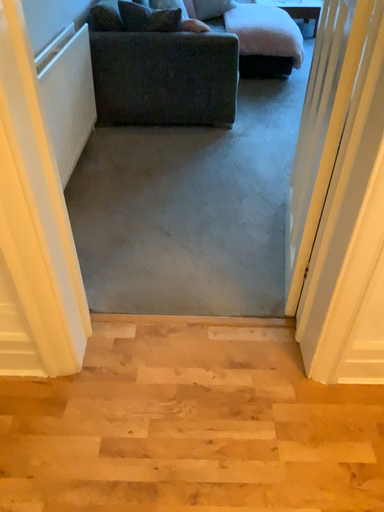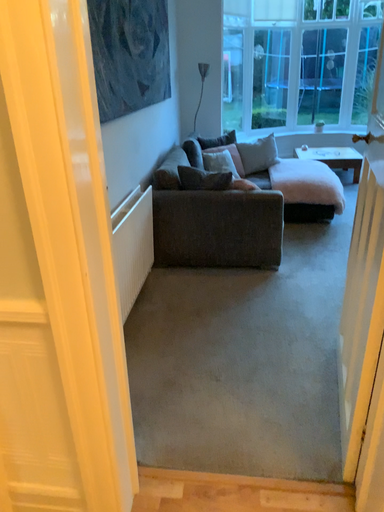
Question: Which way did the camera rotate in the video?

Choices:
 (A) rotated downward
 (B) rotated upward

Answer: (B)